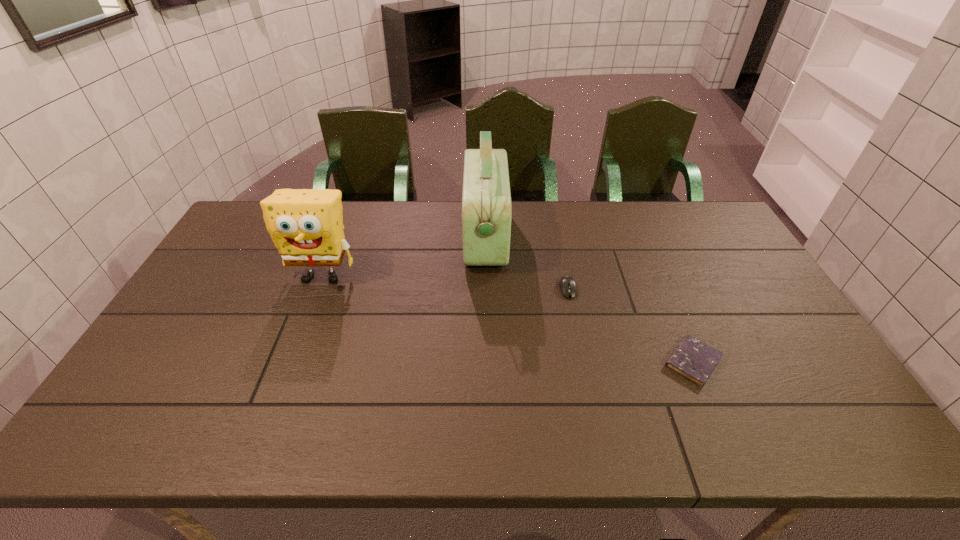
Where is `vacant space situated on the face of the leftmost object`? vacant space situated on the face of the leftmost object is located at coordinates (302, 327).

You are a GUI agent. You are given a task and a screenshot of the screen. Output one action in this format:
    pyautogui.click(x=<x>, y=<y>)
    Task: Click on the free space located on the wheel side of the second shortest object
    
    Given the screenshot: What is the action you would take?
    coord(585,367)

Locate an element on the screen. The image size is (960, 540). free space located 0.350m on the back of the shortest object is located at coordinates (x=647, y=254).

You are a GUI agent. You are given a task and a screenshot of the screen. Output one action in this format:
    pyautogui.click(x=<x>, y=<y>)
    Task: Click on the object located in the far edge section of the desktop
    The width and height of the screenshot is (960, 540).
    Given the screenshot: What is the action you would take?
    pyautogui.click(x=486, y=214)

Locate an element on the screen. free space at the far edge is located at coordinates (575, 232).

Where is `vacant region at the near edge of the desktop`? The width and height of the screenshot is (960, 540). vacant region at the near edge of the desktop is located at coordinates (616, 417).

In the image, there is a desktop. Where is `vacant space at the left edge`? vacant space at the left edge is located at coordinates (213, 299).

Where is `vacant space at the right edge of the desktop`? This screenshot has width=960, height=540. vacant space at the right edge of the desktop is located at coordinates (747, 326).

The width and height of the screenshot is (960, 540). Find the location of `vacant space in between the sponge and the second object from left to right`. vacant space in between the sponge and the second object from left to right is located at coordinates (403, 256).

I want to click on vacant space that's between the third object from left to right and the shortest object, so click(631, 325).